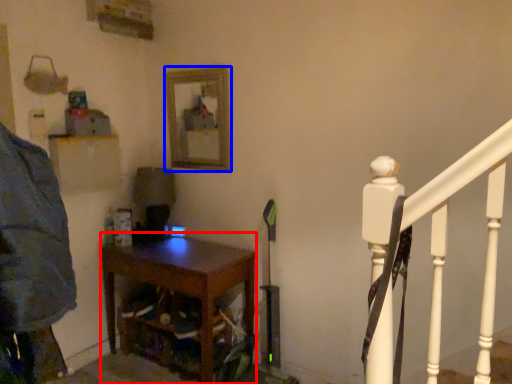
Question: Which object appears farthest to the camera in this image, nightstand (highlighted by a red box) or mirror (highlighted by a blue box)?

Choices:
 (A) nightstand
 (B) mirror

Answer: (B)